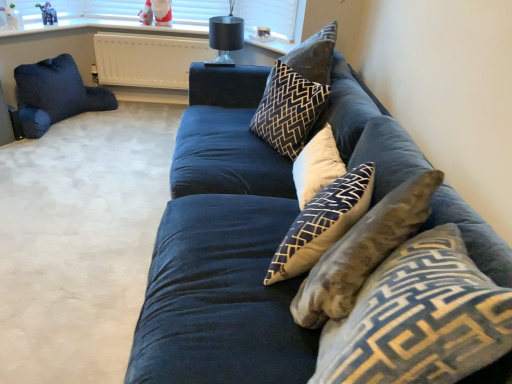
Question: In terms of height, does white soft cushion at center, which is the 3th pillow from back to front, look taller or shorter compared to navy blue fabric couch at center?

Choices:
 (A) tall
 (B) short

Answer: (B)

Question: Considering their positions, is white soft cushion at center, acting as the third pillow starting from the front, located in front of or behind navy blue fabric couch at center?

Choices:
 (A) behind
 (B) front

Answer: (A)

Question: Estimate the real-world distances between objects in this image. Which object is closer to the matte plastic elephant at upper left, the 2th toy viewed from the right?

Choices:
 (A) dark blue velvet pillow at left, which is the fifth pillow from front to back
 (B) dark blue fabric pillow at center, the fourth pillow when ordered from right to left
 (C) white matte radiator at upper center
 (D) white glossy figurine at upper left, the 3th toy positioned from the right
 (E) blue velvet pillow at center, which is the 5th pillow from back to front

Answer: (D)

Question: Which of these objects is positioned farthest from the black glass lamp at upper center?

Choices:
 (A) white cotton cushion at center, which is the third pillow in left-to-right order
 (B) navy blue fabric couch at center
 (C) white soft cushion at center, acting as the third pillow starting from the front
 (D) dark blue fabric pillow at center, which is the 2th pillow in back-to-front order
 (E) dark blue velvet pillow at left, which is the 5th pillow from right to left

Answer: (A)